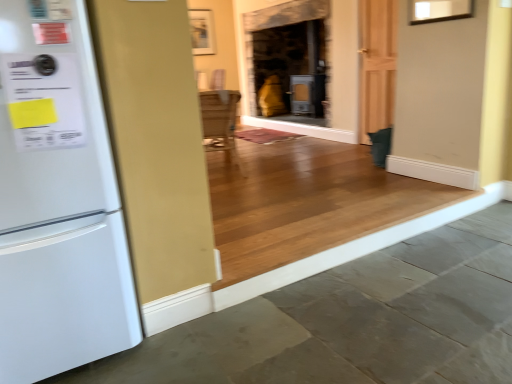
Question: From the image's perspective, is white matte refrigerator at left below wooden frame at upper center?

Choices:
 (A) no
 (B) yes

Answer: (B)

Question: Is white matte refrigerator at left completely or partially outside of wooden frame at upper center?

Choices:
 (A) yes
 (B) no

Answer: (A)

Question: Considering the relative sizes of white matte refrigerator at left and wooden frame at upper center in the image provided, is white matte refrigerator at left smaller than wooden frame at upper center?

Choices:
 (A) yes
 (B) no

Answer: (B)

Question: Considering the relative sizes of white matte refrigerator at left and wooden frame at upper center in the image provided, is white matte refrigerator at left thinner than wooden frame at upper center?

Choices:
 (A) no
 (B) yes

Answer: (A)

Question: Does white matte refrigerator at left have a greater width compared to wooden frame at upper center?

Choices:
 (A) no
 (B) yes

Answer: (B)

Question: From a real-world perspective, does white matte refrigerator at left sit lower than wooden frame at upper center?

Choices:
 (A) no
 (B) yes

Answer: (B)

Question: Is white matte refrigerator at left inside gray concrete at lower left?

Choices:
 (A) yes
 (B) no

Answer: (B)

Question: Does gray concrete at lower left have a lesser height compared to white matte refrigerator at left?

Choices:
 (A) yes
 (B) no

Answer: (A)

Question: Is gray concrete at lower left thinner than white matte refrigerator at left?

Choices:
 (A) no
 (B) yes

Answer: (A)

Question: From the image's perspective, would you say gray concrete at lower left is positioned over white matte refrigerator at left?

Choices:
 (A) yes
 (B) no

Answer: (B)

Question: From a real-world perspective, is gray concrete at lower left positioned over white matte refrigerator at left based on gravity?

Choices:
 (A) yes
 (B) no

Answer: (B)

Question: From a real-world perspective, is gray concrete at lower left positioned under white matte refrigerator at left based on gravity?

Choices:
 (A) no
 (B) yes

Answer: (B)

Question: Considering the relative sizes of white matte refrigerator at left and gray concrete at lower left in the image provided, is white matte refrigerator at left taller than gray concrete at lower left?

Choices:
 (A) yes
 (B) no

Answer: (A)